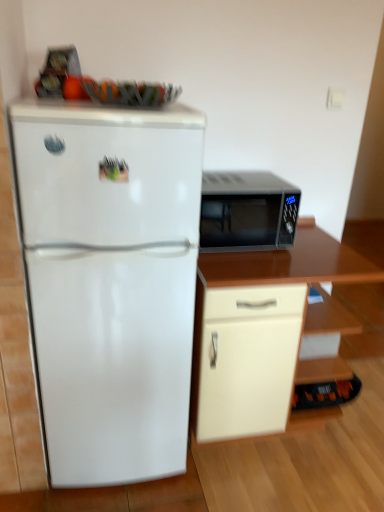
Question: Is beige matte cabinet at lower right located outside white glossy refrigerator at left?

Choices:
 (A) yes
 (B) no

Answer: (A)

Question: Does beige matte cabinet at lower right touch white glossy refrigerator at left?

Choices:
 (A) no
 (B) yes

Answer: (A)

Question: From the image's perspective, would you say beige matte cabinet at lower right is shown under white glossy refrigerator at left?

Choices:
 (A) no
 (B) yes

Answer: (B)

Question: Can you confirm if beige matte cabinet at lower right is positioned to the left of white glossy refrigerator at left?

Choices:
 (A) yes
 (B) no

Answer: (B)

Question: Can you confirm if beige matte cabinet at lower right is shorter than white glossy refrigerator at left?

Choices:
 (A) yes
 (B) no

Answer: (A)

Question: Is beige matte cabinet at lower right to the right of white glossy refrigerator at left from the viewer's perspective?

Choices:
 (A) yes
 (B) no

Answer: (A)

Question: Considering the relative positions of white glossy refrigerator at left and beige matte cabinet at lower right in the image provided, is white glossy refrigerator at left behind beige matte cabinet at lower right?

Choices:
 (A) yes
 (B) no

Answer: (B)

Question: Is white glossy refrigerator at left smaller than beige matte cabinet at lower right?

Choices:
 (A) no
 (B) yes

Answer: (A)

Question: Is white glossy refrigerator at left at the left side of beige matte cabinet at lower right?

Choices:
 (A) yes
 (B) no

Answer: (A)

Question: Does white glossy refrigerator at left have a lesser height compared to beige matte cabinet at lower right?

Choices:
 (A) no
 (B) yes

Answer: (A)

Question: Is white glossy refrigerator at left facing towards beige matte cabinet at lower right?

Choices:
 (A) yes
 (B) no

Answer: (B)

Question: Is white glossy refrigerator at left taller than beige matte cabinet at lower right?

Choices:
 (A) yes
 (B) no

Answer: (A)

Question: Does matte black microwave at right have a greater width compared to beige matte cabinet at lower right?

Choices:
 (A) no
 (B) yes

Answer: (A)